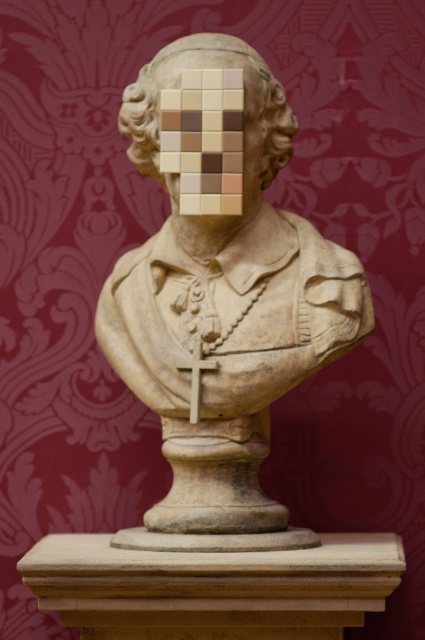
Between stone bust at center and matte stone bust at center, which one is positioned higher?

matte stone bust at center is higher up.

Is stone bust at center above matte stone bust at center?

Actually, stone bust at center is below matte stone bust at center.

Is point (252, 525) closer to camera compared to point (217, 45)?

Yes, point (252, 525) is closer to viewer.

The width and height of the screenshot is (425, 640). In order to click on stone bust at center in this screenshot , I will do click(x=221, y=300).

Between stone bust at center and white wood cross at center, which one has less height?

With less height is white wood cross at center.

Does stone bust at center appear over white wood cross at center?

Correct, stone bust at center is located above white wood cross at center.

Who is more distant from viewer, (206,285) or (201,360)?

The point (206,285) is more distant.

Identify the location of stone bust at center. Image resolution: width=425 pixels, height=640 pixels. (221, 300).

Is point (272, 157) positioned behind point (197, 388)?

Yes, point (272, 157) is behind point (197, 388).

Between point (221, 49) and point (198, 365), which one is positioned in front?

Positioned in front is point (198, 365).

Does point (146, 93) come behind point (178, 368)?

Yes, point (146, 93) is behind point (178, 368).

What are the coordinates of `matte stone bust at center` in the screenshot? It's located at (207, 65).